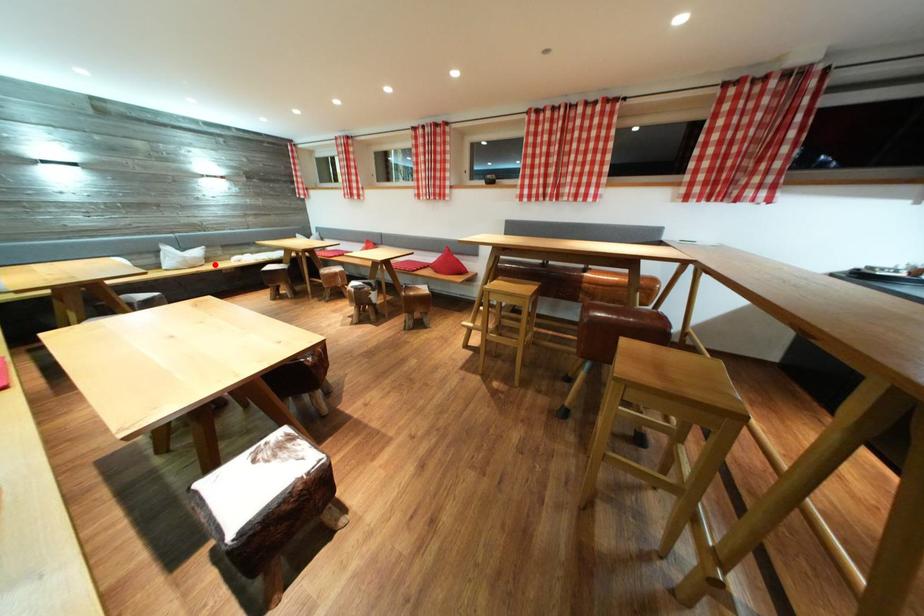
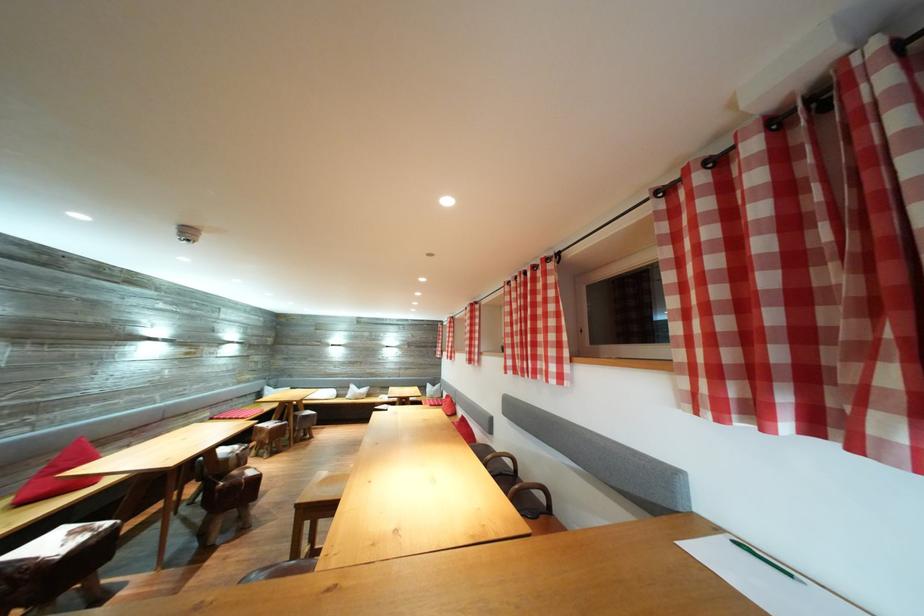
The point at the highlighted location is marked in the first image. Where is the corresponding point in the second image?

(375, 400)